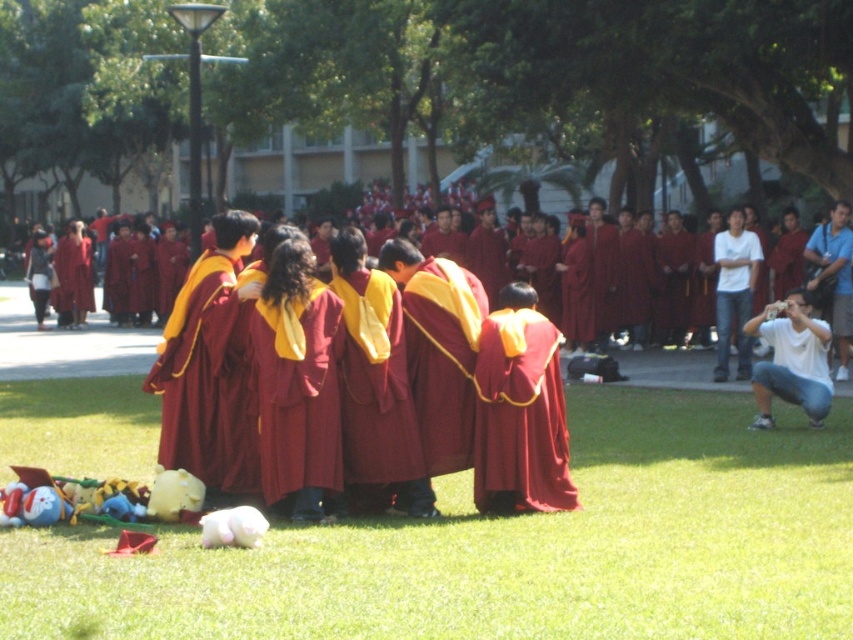
Question: Can you confirm if white cotton shirt at lower right is thinner than white cotton shirt at right?

Choices:
 (A) no
 (B) yes

Answer: (A)

Question: Which point appears farthest from the camera in this image?

Choices:
 (A) (752, 241)
 (B) (631, 385)
 (C) (109, 424)
 (D) (207, 456)

Answer: (A)

Question: Considering the real-world distances, which object is closest to the white cotton shirt at lower right?

Choices:
 (A) white cotton shirt at right
 (B) maroon velvet graduation gown at center
 (C) green grass at lower center
 (D) matte red graduation gown at center

Answer: (C)

Question: Can you confirm if green grass at lower center is bigger than white cotton shirt at lower right?

Choices:
 (A) yes
 (B) no

Answer: (A)

Question: Among these points, which one is farthest from the camera?

Choices:
 (A) (737, 234)
 (B) (663, 598)

Answer: (A)

Question: Does matte red graduation gown at center appear on the left side of white cotton shirt at right?

Choices:
 (A) yes
 (B) no

Answer: (A)